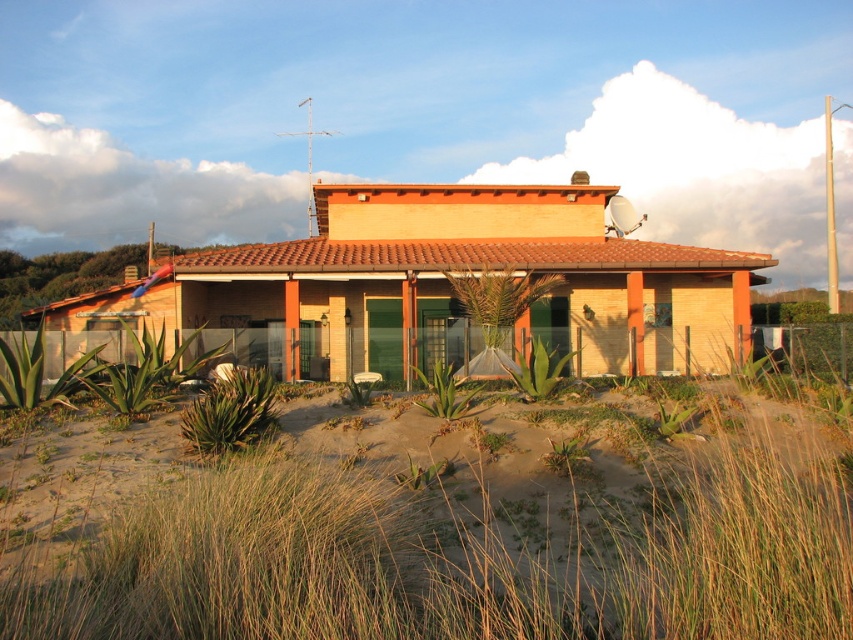
Is brown sandy beach at lower center in front of matte orange house at center?

Yes, it is.

Identify the location of brown sandy beach at lower center. This screenshot has height=640, width=853. (453, 531).